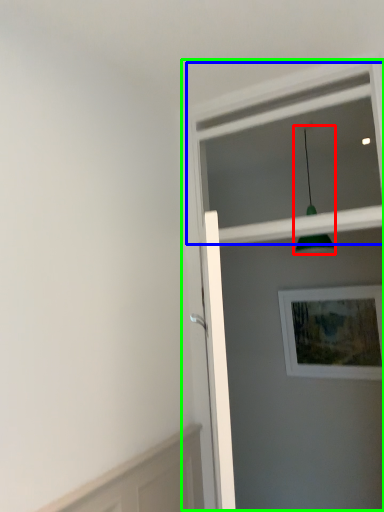
Question: Which object is positioned closest to light fixture (highlighted by a red box)? Select from window frame (highlighted by a blue box) and screen door (highlighted by a green box).

Choices:
 (A) window frame
 (B) screen door

Answer: (A)